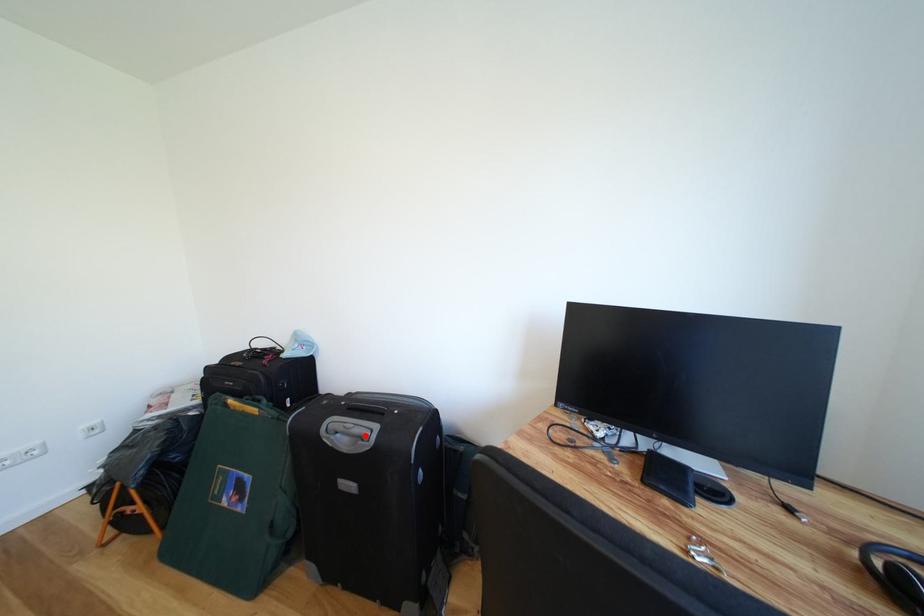
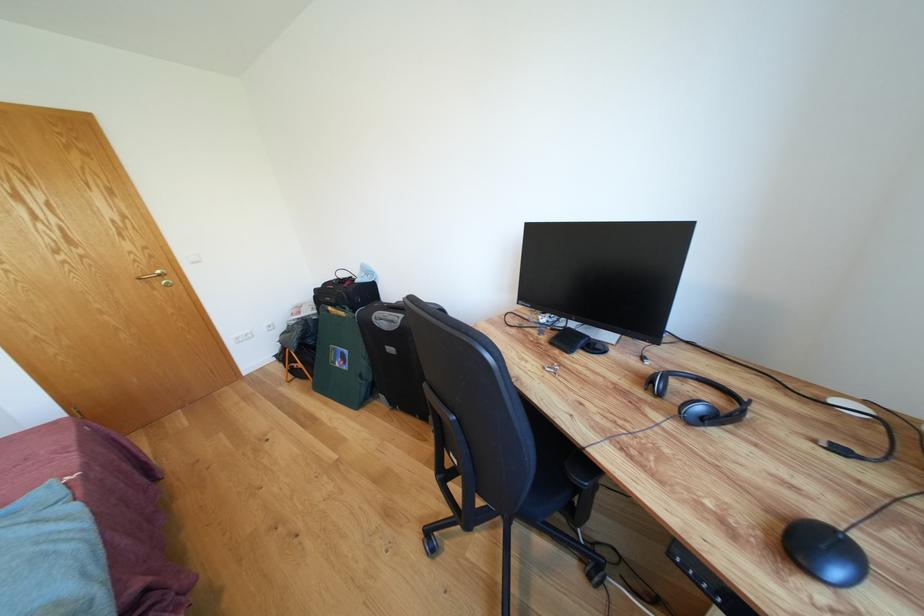
In the second image, find the point that corresponds to the highlighted location in the first image.

(398, 322)